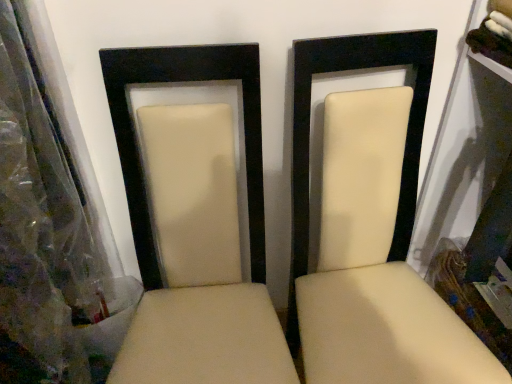
Question: In terms of size, does beige leather chair at center, positioned as the second chair in left-to-right order, appear bigger or smaller than beige leather chair at center, marked as the 1th chair in a left-to-right arrangement?

Choices:
 (A) big
 (B) small

Answer: (A)

Question: Considering the positions of beige leather chair at center, which ranks as the 1th chair in right-to-left order, and beige leather chair at center, which is the second chair from right to left, in the image, is beige leather chair at center, which ranks as the 1th chair in right-to-left order, taller or shorter than beige leather chair at center, which is the second chair from right to left,?

Choices:
 (A) tall
 (B) short

Answer: (A)

Question: Visually, is beige leather chair at center, positioned as the second chair in left-to-right order, positioned to the left or to the right of beige leather chair at center, which is the second chair from right to left?

Choices:
 (A) left
 (B) right

Answer: (B)

Question: Looking at the image, does beige leather chair at center, which is the second chair from right to left, seem bigger or smaller compared to beige leather chair at center, which ranks as the 1th chair in right-to-left order?

Choices:
 (A) small
 (B) big

Answer: (A)

Question: From the image's perspective, is beige leather chair at center, marked as the 1th chair in a left-to-right arrangement, positioned above or below beige leather chair at center, which ranks as the 1th chair in right-to-left order?

Choices:
 (A) below
 (B) above

Answer: (A)

Question: In the image, is beige leather chair at center, which is the second chair from right to left, positioned in front of or behind beige leather chair at center, positioned as the second chair in left-to-right order?

Choices:
 (A) behind
 (B) front

Answer: (B)

Question: In terms of height, does beige leather chair at center, which is the second chair from right to left, look taller or shorter compared to beige leather chair at center, positioned as the second chair in left-to-right order?

Choices:
 (A) tall
 (B) short

Answer: (B)